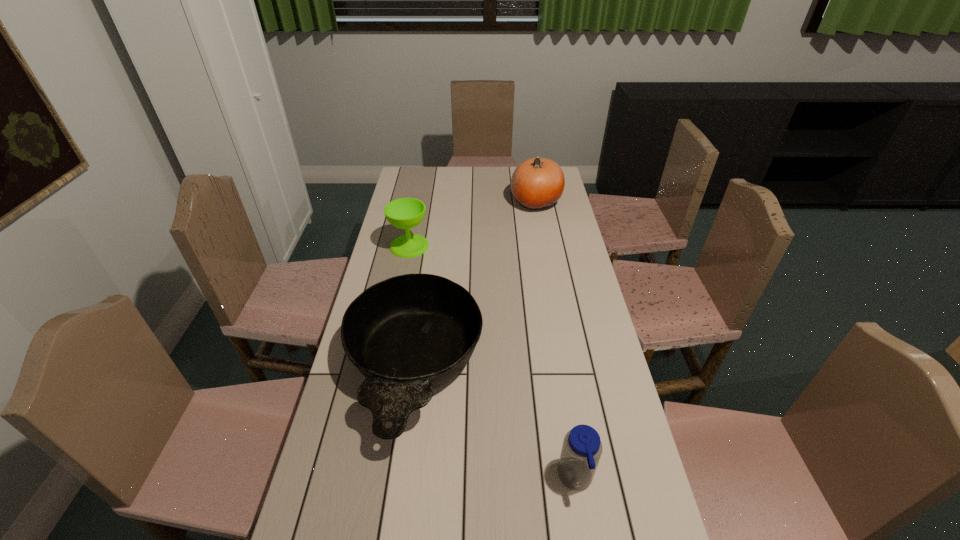
Where is `free space between the third nearest object and the farthest object`? The height and width of the screenshot is (540, 960). free space between the third nearest object and the farthest object is located at coordinates (472, 224).

Image resolution: width=960 pixels, height=540 pixels. Identify the location of free point between the water bottle and the frying pan. (494, 424).

Identify the location of vacant area that lies between the water bottle and the frying pan. (494, 424).

Find the location of a particular element. empty location between the pumpkin and the wineglass is located at coordinates (472, 224).

Locate an element on the screen. This screenshot has height=540, width=960. free space between the frying pan and the pumpkin is located at coordinates (475, 285).

Identify which object is located as the third nearest to the water bottle. Please provide its 2D coordinates. Your answer should be formatted as a tuple, i.e. [(x, y)], where the tuple contains the x and y coordinates of a point satisfying the conditions above.

[(537, 183)]

Select which object appears as the third closest to the pumpkin. Please provide its 2D coordinates. Your answer should be formatted as a tuple, i.e. [(x, y)], where the tuple contains the x and y coordinates of a point satisfying the conditions above.

[(582, 448)]